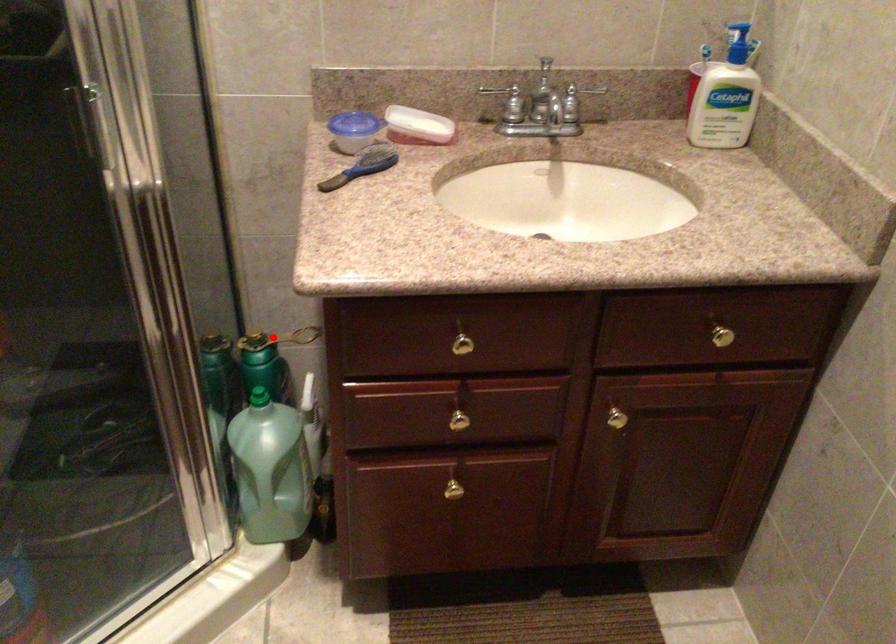
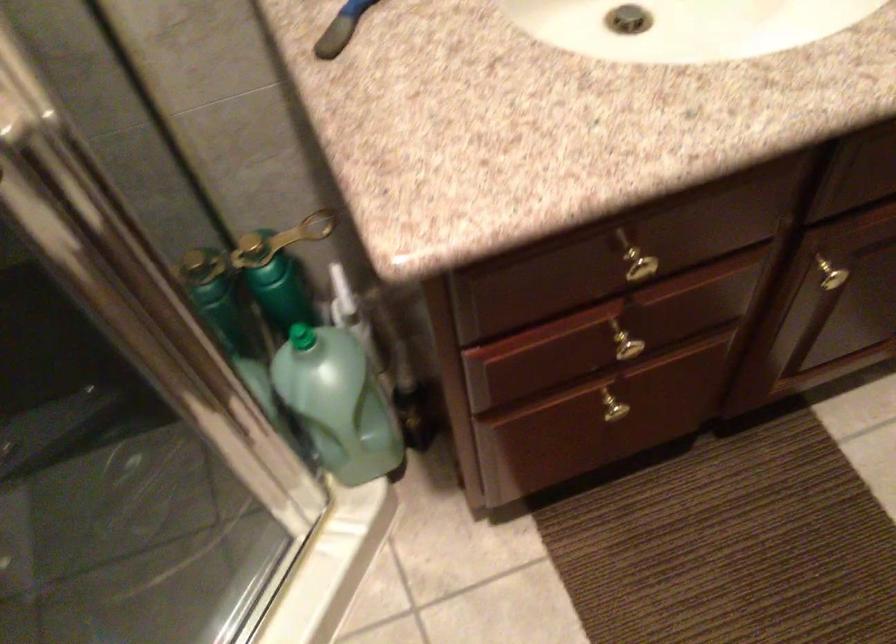
Question: I am providing you with two images of the same scene from different viewpoints. In image1, a red point is highlighted. Considering the same 3D point in image2, which of the following is correct?

Choices:
 (A) It is closer
 (B) It is farther

Answer: (A)